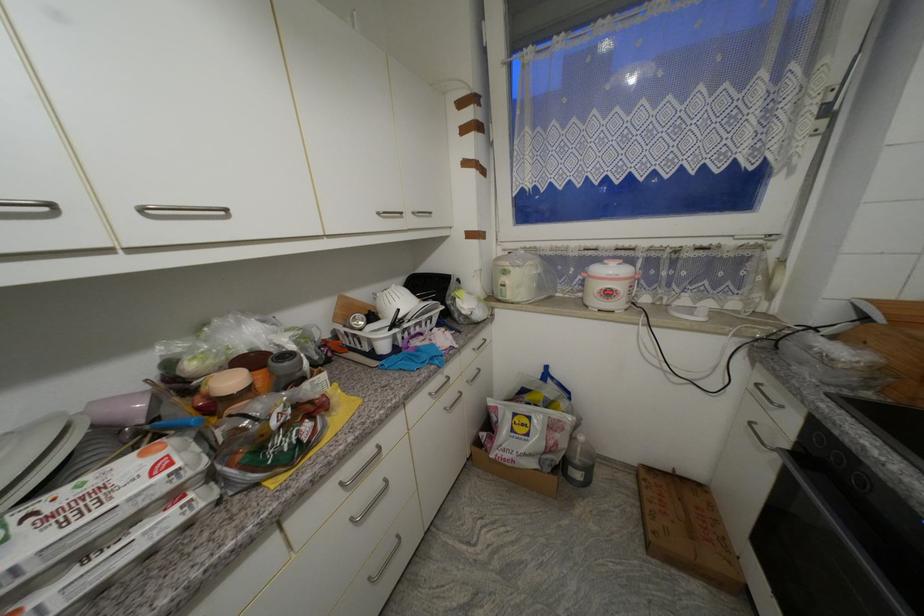
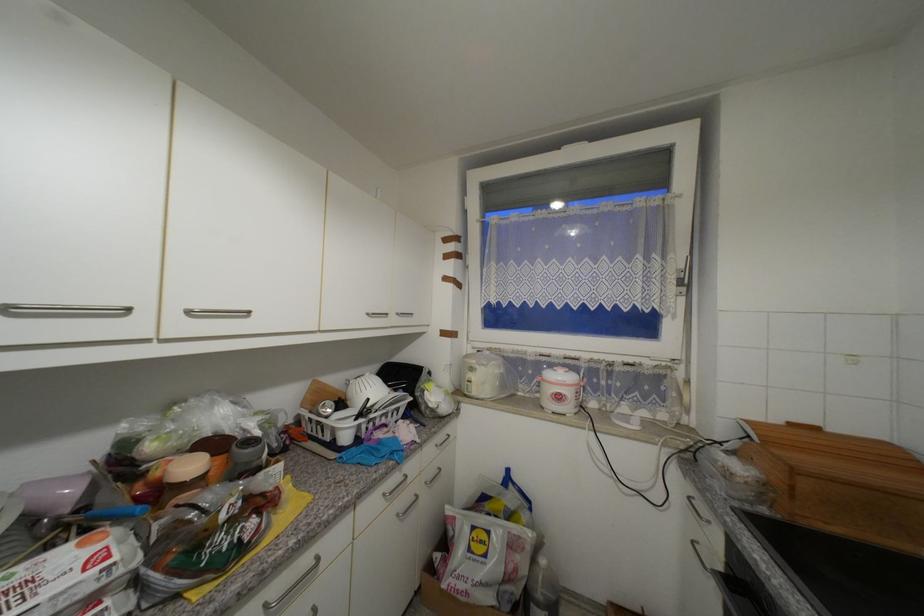
Question: In a continuous first-person perspective shot, in which direction is the camera moving?

Choices:
 (A) Left
 (B) Right
 (C) Forward
 (D) Backward

Answer: (D)